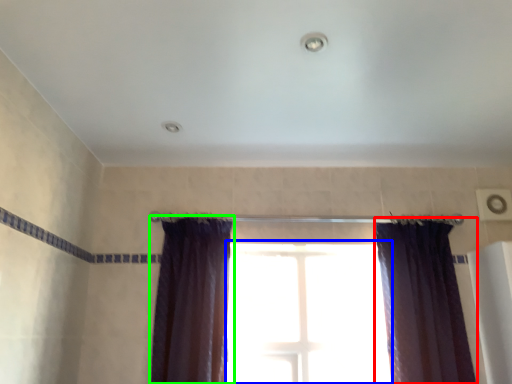
Question: Which object is the farthest from curtain (highlighted by a red box)? Choose among these: window (highlighted by a blue box) or curtain (highlighted by a green box).

Choices:
 (A) window
 (B) curtain

Answer: (B)